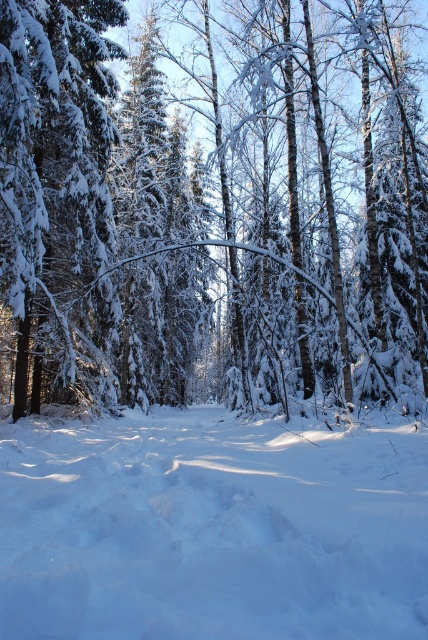
In the scene shown: You are standing in the forest and want to walk from the point at coordinates point (210, 202) to the point at coordinates point (15, 461). Which direction should you face to move towards your destination?

You should face towards the lower right direction to move from point (210, 202) to point (15, 461) because point (15, 461) is in front of point (210, 202).